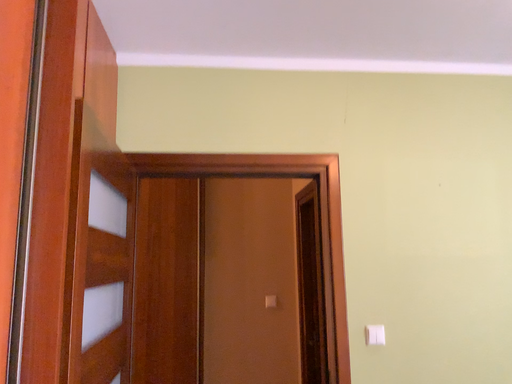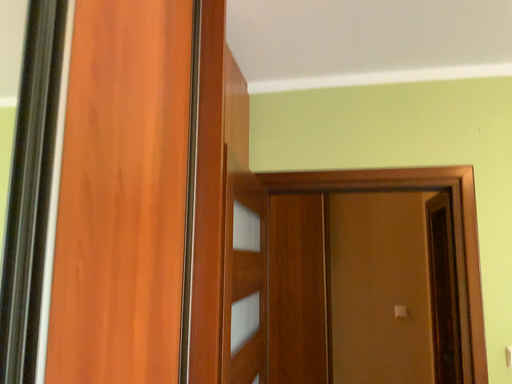
Question: Which way did the camera rotate in the video?

Choices:
 (A) rotated left
 (B) rotated right

Answer: (A)